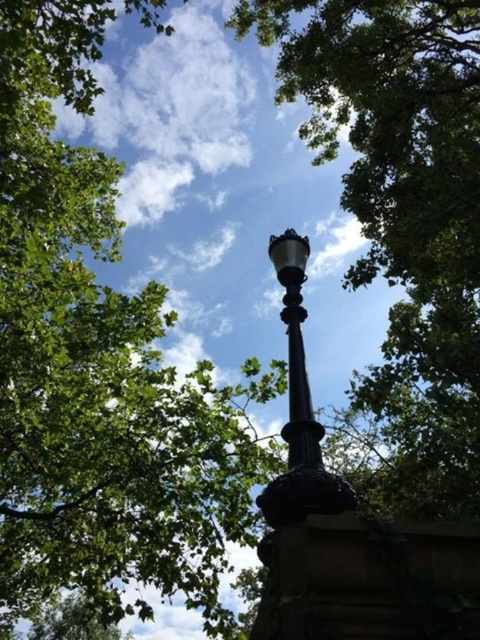
Question: Which point is closer to the camera?

Choices:
 (A) polished black lamppost at upper center
 (B) black polished metal pole at center

Answer: (A)

Question: Can you confirm if polished black lamppost at upper center is positioned to the right of black polished metal pole at center?

Choices:
 (A) no
 (B) yes

Answer: (B)

Question: Is polished black lamppost at upper center positioned before black polished metal pole at center?

Choices:
 (A) no
 (B) yes

Answer: (B)

Question: Does polished black lamppost at upper center appear over black polished metal pole at center?

Choices:
 (A) no
 (B) yes

Answer: (B)